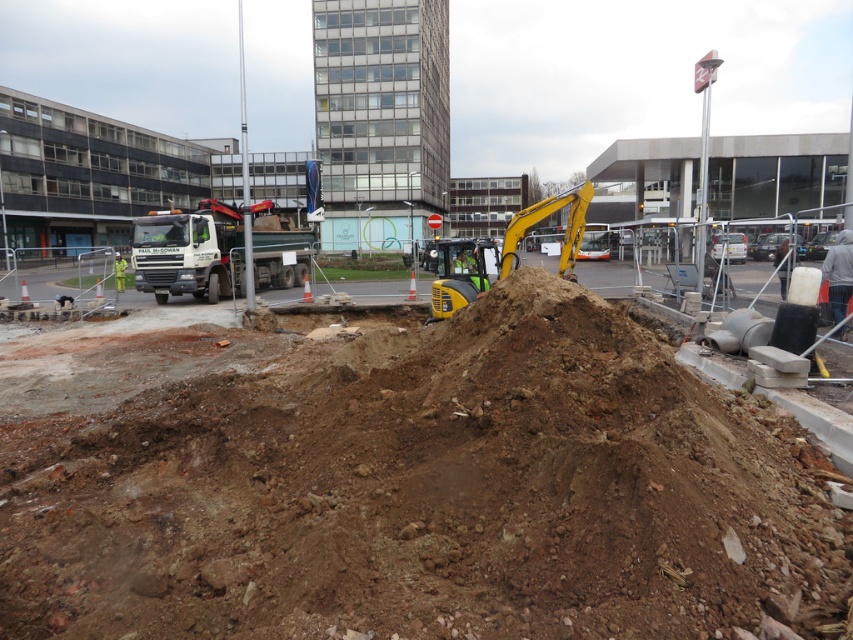
Question: Which point is closer to the camera?

Choices:
 (A) (70, 483)
 (B) (572, 221)

Answer: (A)

Question: In this image, where is matte white truck at center located relative to yellow rubber excavator at center?

Choices:
 (A) right
 (B) left

Answer: (B)

Question: Which of the following is the closest to the observer?

Choices:
 (A) yellow rubber excavator at center
 (B) matte white truck at center
 (C) brown earth at center

Answer: (C)

Question: Which of the following is the closest to the observer?

Choices:
 (A) brown earth at center
 (B) matte white truck at center

Answer: (A)

Question: Is brown earth at center smaller than yellow rubber excavator at center?

Choices:
 (A) yes
 (B) no

Answer: (B)

Question: Is brown earth at center further to the viewer compared to yellow rubber excavator at center?

Choices:
 (A) yes
 (B) no

Answer: (B)